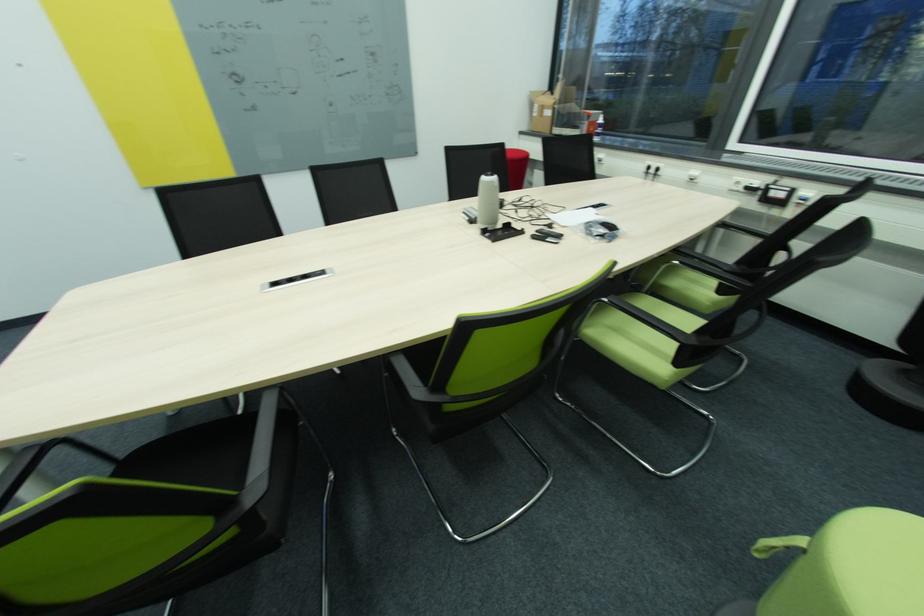
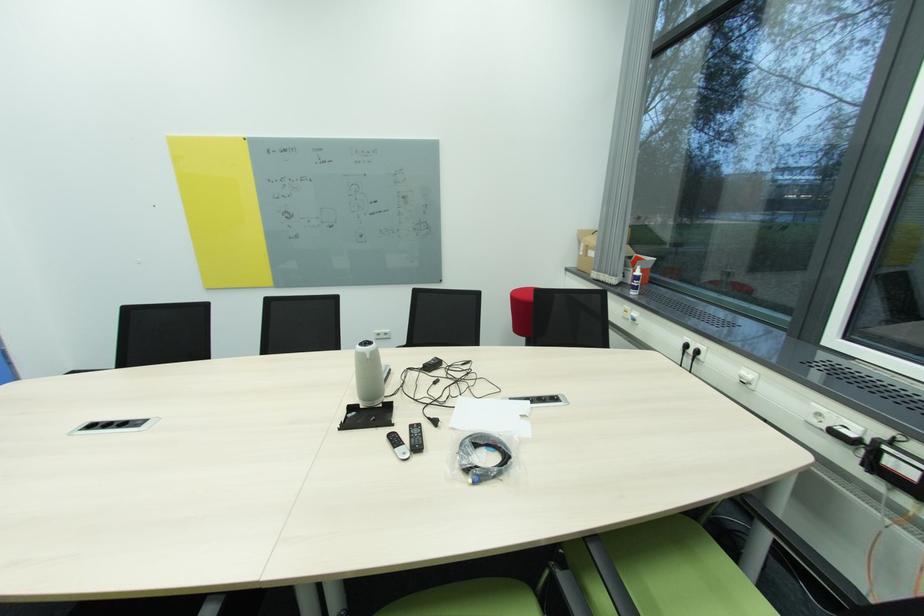
The point at (602, 126) is marked in the first image. Where is the corresponding point in the second image?

(639, 277)